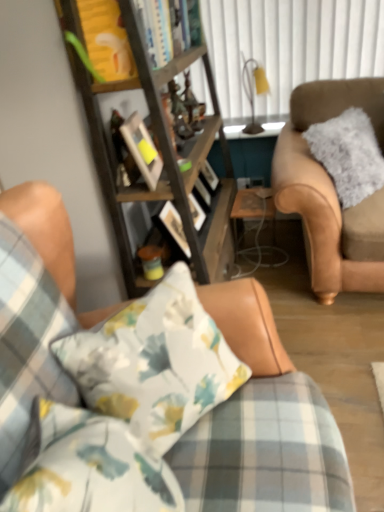
Question: From a real-world perspective, does clear glass table at center sit lower than wooden picture frame at center?

Choices:
 (A) no
 (B) yes

Answer: (B)

Question: Does clear glass table at center contain wooden picture frame at center?

Choices:
 (A) no
 (B) yes

Answer: (A)

Question: Does clear glass table at center appear on the right side of wooden picture frame at center?

Choices:
 (A) yes
 (B) no

Answer: (A)

Question: Can we say clear glass table at center lies outside wooden picture frame at center?

Choices:
 (A) no
 (B) yes

Answer: (B)

Question: Does clear glass table at center have a greater height compared to wooden picture frame at center?

Choices:
 (A) yes
 (B) no

Answer: (A)

Question: Considering the positions of wooden bookshelf at center and floral fabric couch at center in the image, is wooden bookshelf at center taller or shorter than floral fabric couch at center?

Choices:
 (A) short
 (B) tall

Answer: (B)

Question: From a real-world perspective, is wooden bookshelf at center above or below floral fabric couch at center?

Choices:
 (A) below
 (B) above

Answer: (B)

Question: Relative to floral fabric couch at center, is wooden bookshelf at center in front or behind?

Choices:
 (A) front
 (B) behind

Answer: (B)

Question: From the image's perspective, is wooden bookshelf at center above or below floral fabric couch at center?

Choices:
 (A) below
 (B) above

Answer: (B)

Question: In terms of width, does wooden bookshelf at center look wider or thinner when compared to wooden picture frame at center?

Choices:
 (A) thin
 (B) wide

Answer: (B)

Question: From the image's perspective, relative to wooden picture frame at center, is wooden bookshelf at center above or below?

Choices:
 (A) above
 (B) below

Answer: (A)

Question: Is point (87, 117) closer or farther from the camera than point (127, 118)?

Choices:
 (A) closer
 (B) farther

Answer: (A)

Question: Based on their positions, is wooden bookshelf at center located to the left or right of wooden picture frame at center?

Choices:
 (A) right
 (B) left

Answer: (A)

Question: In the image, is wooden picture frame at center positioned in front of or behind matte brown coffee cup at center?

Choices:
 (A) behind
 (B) front

Answer: (B)

Question: In terms of size, does wooden picture frame at center appear bigger or smaller than matte brown coffee cup at center?

Choices:
 (A) small
 (B) big

Answer: (B)